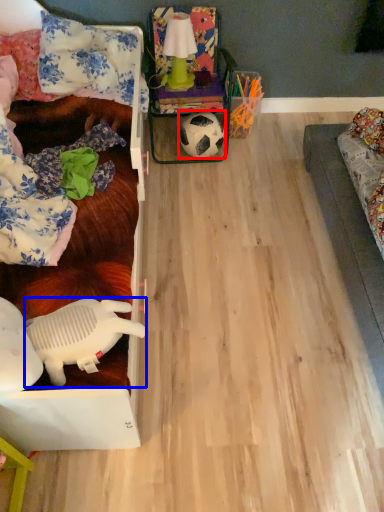
Question: Which object appears farthest to the camera in this image, football (highlighted by a red box) or toy (highlighted by a blue box)?

Choices:
 (A) football
 (B) toy

Answer: (A)